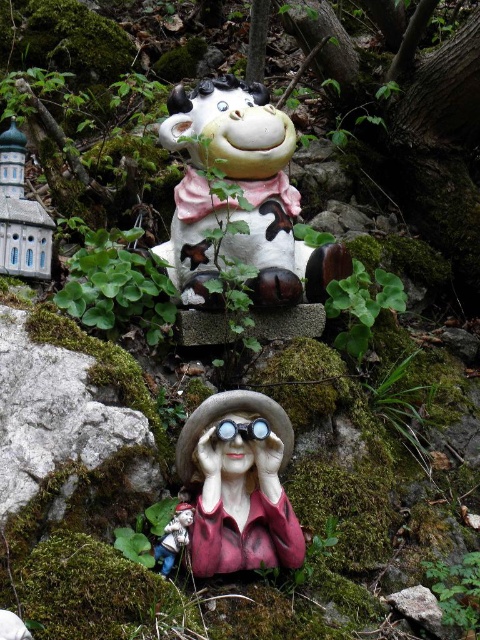
Who is shorter, matte ceramic cow at center or matte pink porcelain doll at center?

Standing shorter between the two is matte pink porcelain doll at center.

Is matte ceramic cow at center bigger than matte pink porcelain doll at center?

Correct, matte ceramic cow at center is larger in size than matte pink porcelain doll at center.

Where is `matte ceramic cow at center`? matte ceramic cow at center is located at coordinates (243, 195).

Find the location of `matte ceramic cow at center`. matte ceramic cow at center is located at coordinates (243, 195).

Does matte ceramic cow at center have a lesser width compared to wooden gnome at lower center?

Incorrect, matte ceramic cow at center's width is not less than wooden gnome at lower center's.

Which is behind, point (188, 99) or point (181, 545)?

Positioned behind is point (188, 99).

You are a GUI agent. You are given a task and a screenshot of the screen. Output one action in this format:
    pyautogui.click(x=<x>, y=<y>)
    Task: Click on the matte ceramic cow at center
    The width and height of the screenshot is (480, 640).
    Given the screenshot: What is the action you would take?
    pyautogui.click(x=243, y=195)

Which of these two, matte pink porcelain doll at center or wooden gnome at lower center, stands taller?

matte pink porcelain doll at center is taller.

Who is more forward, (177, 451) or (159, 552)?

Point (159, 552) is more forward.

Which is behind, point (247, 493) or point (186, 545)?

Point (247, 493)

This screenshot has width=480, height=640. Find the location of `matte pink porcelain doll at center`. matte pink porcelain doll at center is located at coordinates pos(239,486).